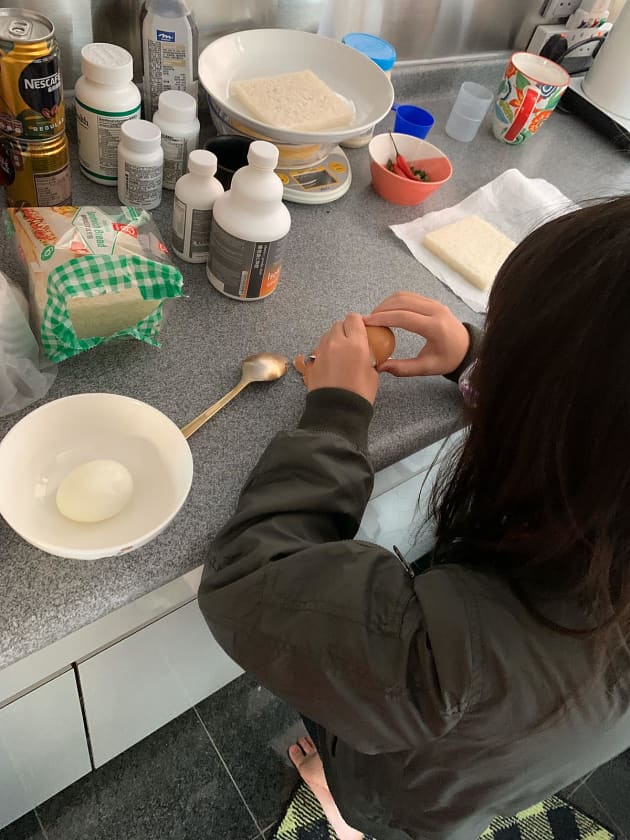
I want to click on countertop, so pyautogui.click(x=230, y=455).